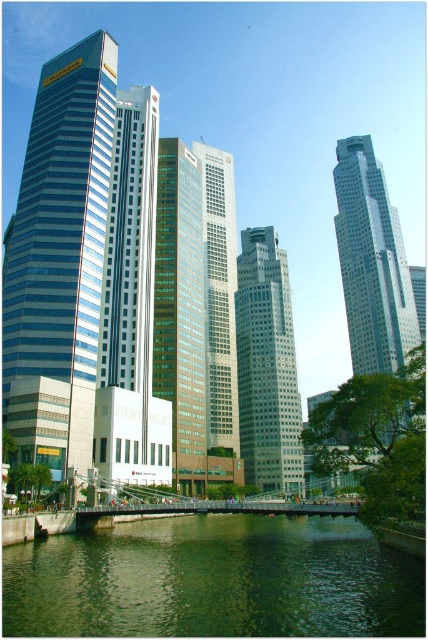
You are standing at point [130,307] in the urban landscape. What object are you directly at?

You are directly at the glassy steel skyscraper at center located at point [130,307].

You are standing at point (214,580) in the urban landscape. What do you see immediately around you?

At point (214,580) lies green liquid water at lower center.